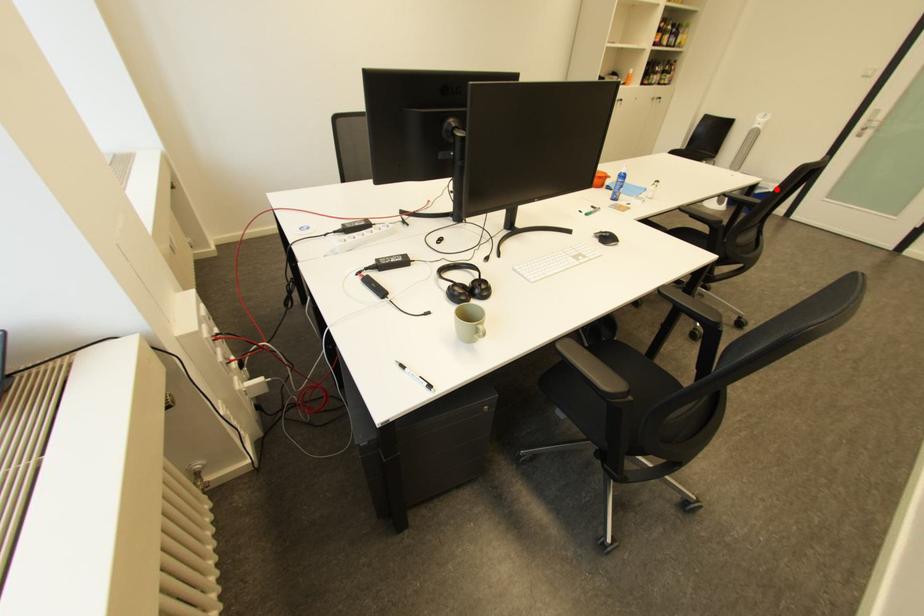
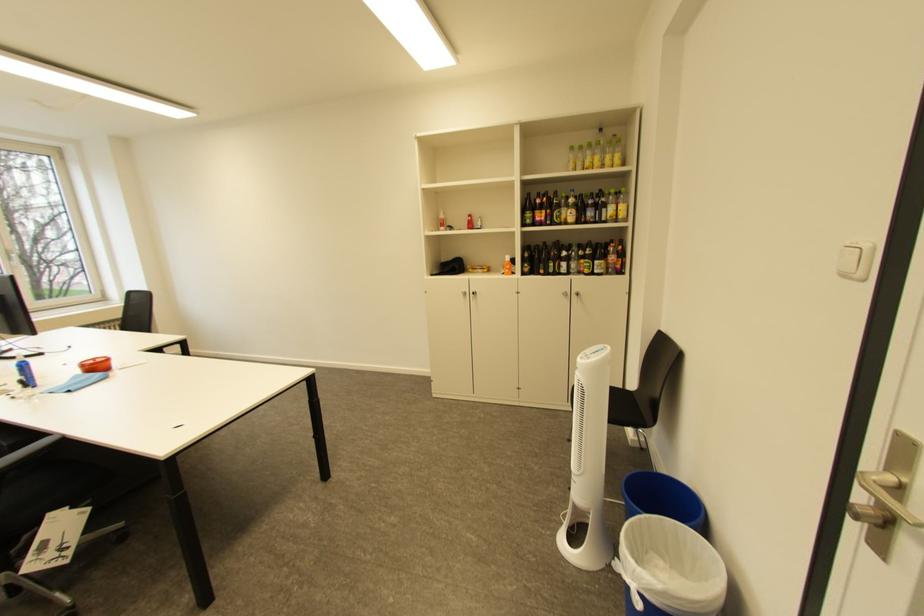
In the second image, find the point that corresponds to the highlighted location in the first image.

(636, 570)